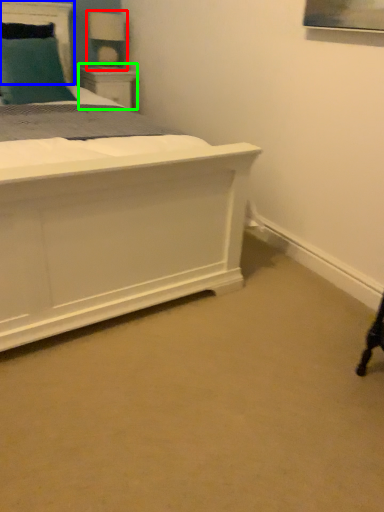
Question: Estimate the real-world distances between objects in this image. Which object is closer to table lamp (highlighted by a red box), headboard (highlighted by a blue box) or nightstand (highlighted by a green box)?

Choices:
 (A) headboard
 (B) nightstand

Answer: (B)